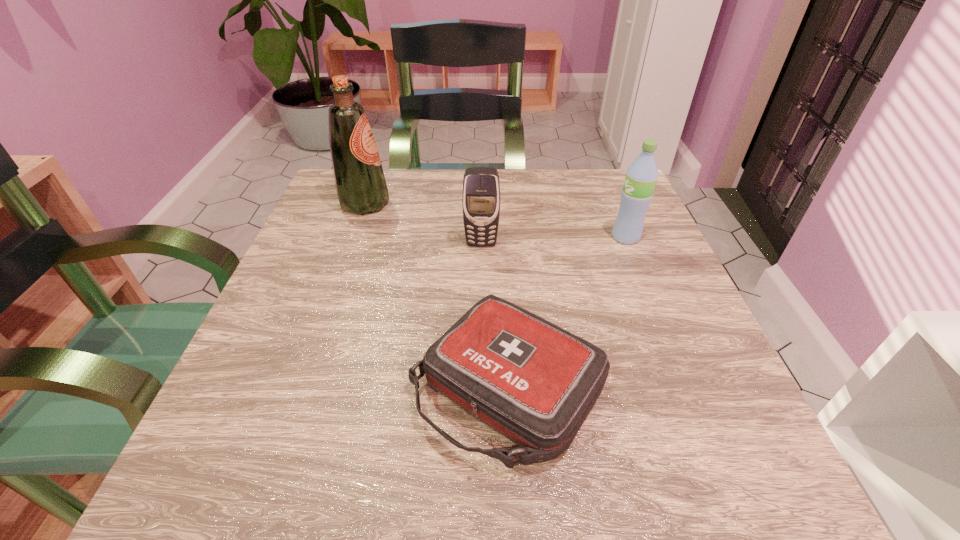
Find the location of `vacant point at the far right corner`. vacant point at the far right corner is located at coordinates (573, 207).

This screenshot has width=960, height=540. I want to click on vacant region at the near right corner of the desktop, so [739, 472].

The width and height of the screenshot is (960, 540). In order to click on unoccupied position between the cellular telephone and the tallest object in this screenshot , I will do `click(423, 224)`.

The width and height of the screenshot is (960, 540). What are the coordinates of `free space between the second shortest object and the rightmost object` in the screenshot? It's located at (553, 240).

Where is `vacant space that's between the third shortest object and the first-aid kit`? This screenshot has width=960, height=540. vacant space that's between the third shortest object and the first-aid kit is located at coordinates (566, 313).

This screenshot has height=540, width=960. In order to click on free spot between the third tallest object and the third shortest object in this screenshot , I will do `click(553, 240)`.

Locate an element on the screen. free space between the cellular telephone and the rightmost object is located at coordinates pyautogui.click(x=553, y=240).

The width and height of the screenshot is (960, 540). Find the location of `free space between the first-aid kit and the second tallest object`. free space between the first-aid kit and the second tallest object is located at coordinates (566, 313).

The width and height of the screenshot is (960, 540). Find the location of `free space between the cellular telephone and the second tallest object`. free space between the cellular telephone and the second tallest object is located at coordinates (553, 240).

Where is `object that is the third closest to the third tallest object`? This screenshot has height=540, width=960. object that is the third closest to the third tallest object is located at coordinates (641, 177).